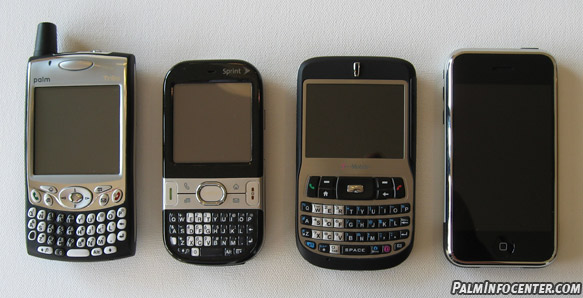
Where is `turned off, blank screens`? This screenshot has height=298, width=583. turned off, blank screens is located at coordinates (93, 110), (201, 119), (372, 127), (544, 149).